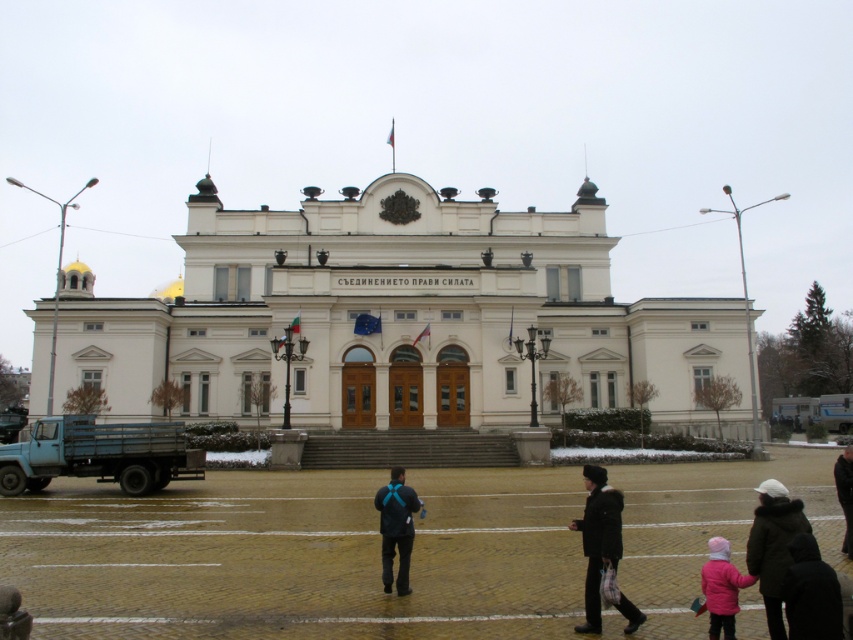
You are standing in front of the grand neoclassical building and want to determine the relative positions of two points marked on the facade. Which of the two points, point 1 at coordinates [772,561] or point 2 at [837,467], is closer to you?

Point 1 at coordinates [772,561] is closer to the viewer than point 2 at [837,467].

You are standing at point (393,320). What can you see directly in front of you?

You can see the white stone building at center directly in front of you at point (393,320).